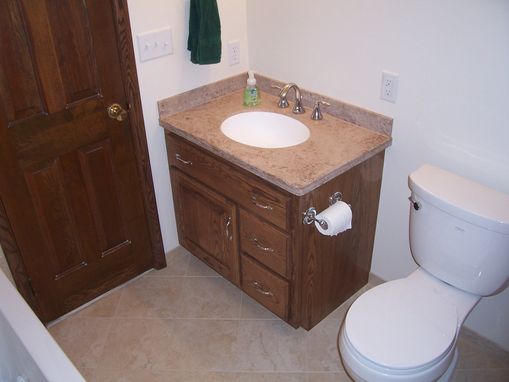
This screenshot has height=382, width=509. Identify the location of toilet tank lid. (475, 197).